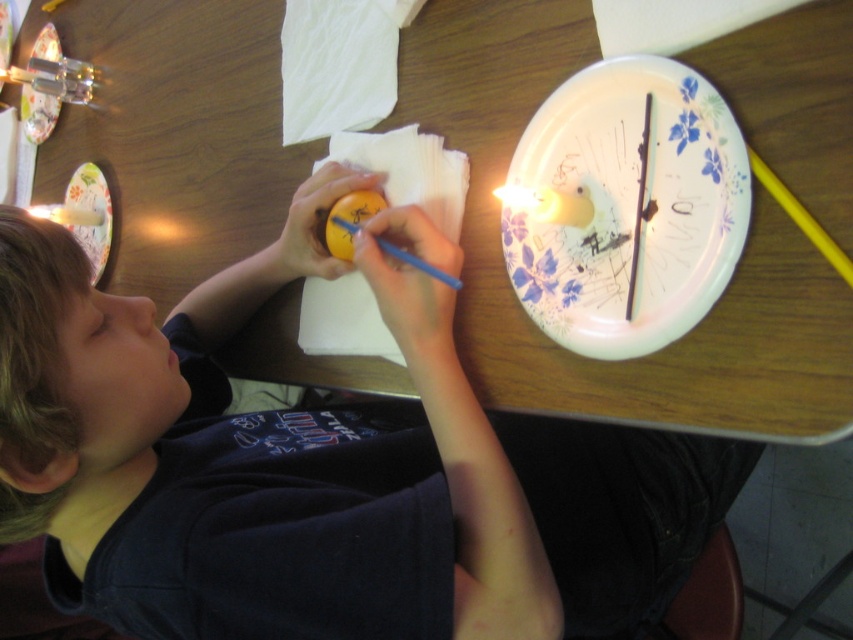
Question: Is smooth yellow egg at center smaller than floral paper plate at upper center?

Choices:
 (A) yes
 (B) no

Answer: (B)

Question: Among these objects, which one is nearest to the camera?

Choices:
 (A) metallic silver candlestick at upper left
 (B) smooth yellow egg at center

Answer: (B)

Question: Among these objects, which one is nearest to the camera?

Choices:
 (A) smooth yellow egg at center
 (B) wooden table at center
 (C) floral paper plate at upper right

Answer: (A)

Question: Is floral paper plate at upper right positioned at the back of yellow matte egg at center?

Choices:
 (A) no
 (B) yes

Answer: (A)

Question: Which object is the farthest from the metallic silver candlestick at upper left?

Choices:
 (A) smooth yellow egg at center
 (B) wooden table at center
 (C) floral paper plate at upper center
 (D) floral paper plate at upper right

Answer: (D)

Question: Does floral paper plate at upper right appear on the left side of metallic silver candlestick at upper left?

Choices:
 (A) yes
 (B) no

Answer: (B)